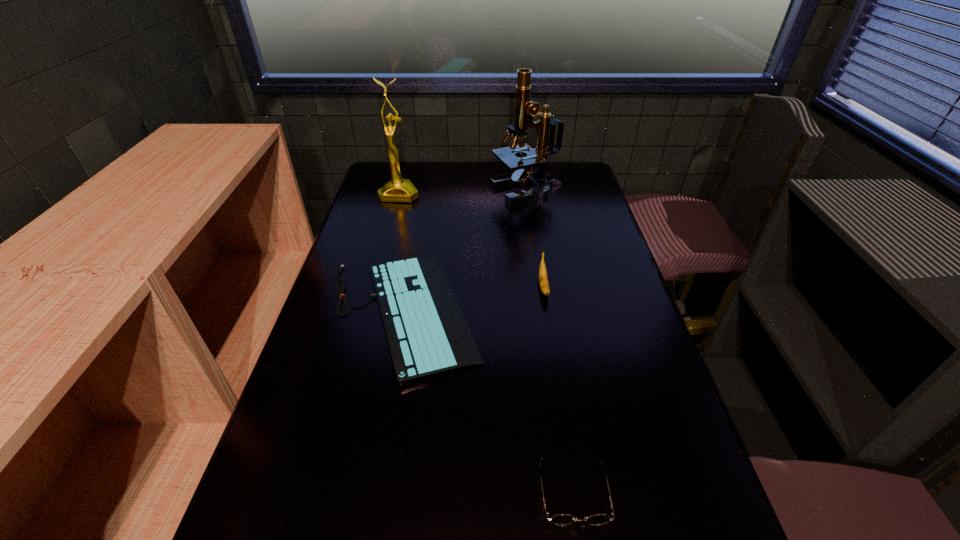
Find the location of a particular element. This screenshot has width=960, height=540. free area in between the computer keyboard and the award is located at coordinates (401, 253).

This screenshot has height=540, width=960. Identify the location of free spot between the award and the microscope. (463, 192).

Find the location of `object that is the third closest to the microscope`. object that is the third closest to the microscope is located at coordinates (543, 279).

Identify the location of object identified as the second closest to the nearest object. This screenshot has width=960, height=540. (543, 279).

At what (x,y) coordinates should I click in order to perform the action: click on free space that satisfies the following two spatial constraints: 1. on the front-facing side of the computer keyboard; 2. on the left side of the award. Please return your answer as a coordinate pair (x, y). Looking at the image, I should click on (368, 313).

Where is `blank space that satisfies the following two spatial constraints: 1. at the eyepiece of the microscope; 2. on the front-facing side of the award`? blank space that satisfies the following two spatial constraints: 1. at the eyepiece of the microscope; 2. on the front-facing side of the award is located at coordinates (527, 194).

Identify the location of vacant space that satisfies the following two spatial constraints: 1. on the front-facing side of the award; 2. on the right side of the computer keyboard. The width and height of the screenshot is (960, 540). (368, 313).

Identify the location of vacant space that satisfies the following two spatial constraints: 1. at the eyepiece of the microscope; 2. on the front-facing side of the award. The width and height of the screenshot is (960, 540). (527, 194).

I want to click on vacant point that satisfies the following two spatial constraints: 1. on the front-facing side of the award; 2. on the right side of the computer keyboard, so click(368, 313).